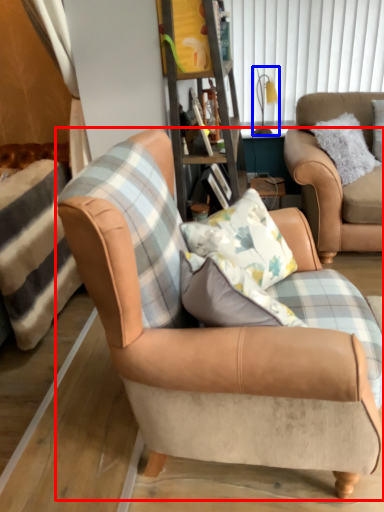
Question: Among these objects, which one is farthest to the camera, chair (highlighted by a red box) or lamp (highlighted by a blue box)?

Choices:
 (A) chair
 (B) lamp

Answer: (B)